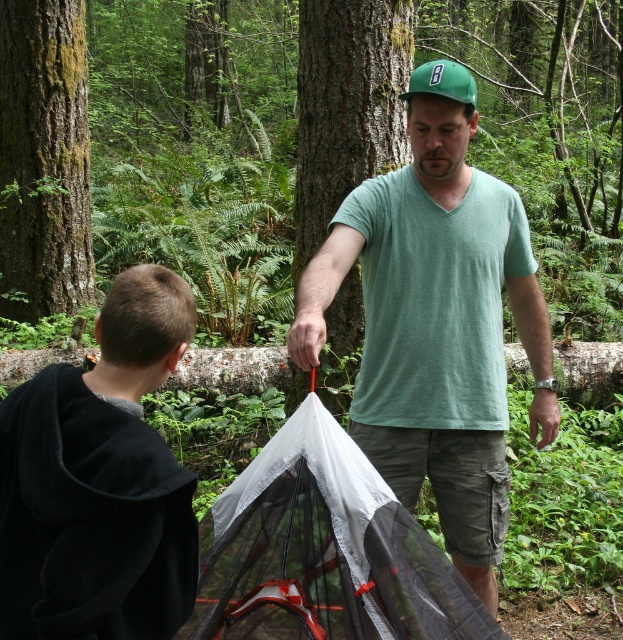
Consider the image. What are the coordinates of the transparent mesh tent at center?

The transparent mesh tent at center is located at coordinates point (x=323, y=550).